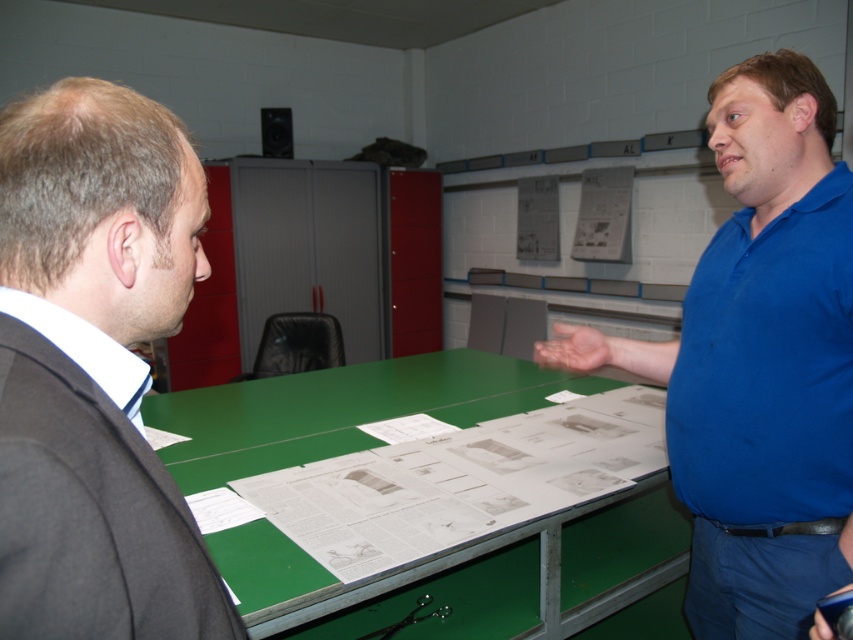
Question: Observing the image, what is the correct spatial positioning of blue cotton shirt at center in reference to green matte table at center?

Choices:
 (A) left
 (B) right

Answer: (B)

Question: Can you confirm if blue cotton shirt at center is thinner than green matte table at center?

Choices:
 (A) no
 (B) yes

Answer: (B)

Question: Which point is farther to the camera?

Choices:
 (A) green matte table at center
 (B) blue cotton shirt at center

Answer: (A)

Question: Among these points, which one is farthest from the camera?

Choices:
 (A) (96, 502)
 (B) (735, 124)
 (C) (676, 502)

Answer: (C)

Question: Which object is the closest to the green matte table at center?

Choices:
 (A) blue cotton shirt at center
 (B) dark gray suit at left

Answer: (A)

Question: Does blue cotton shirt at center lie in front of green matte table at center?

Choices:
 (A) no
 (B) yes

Answer: (B)